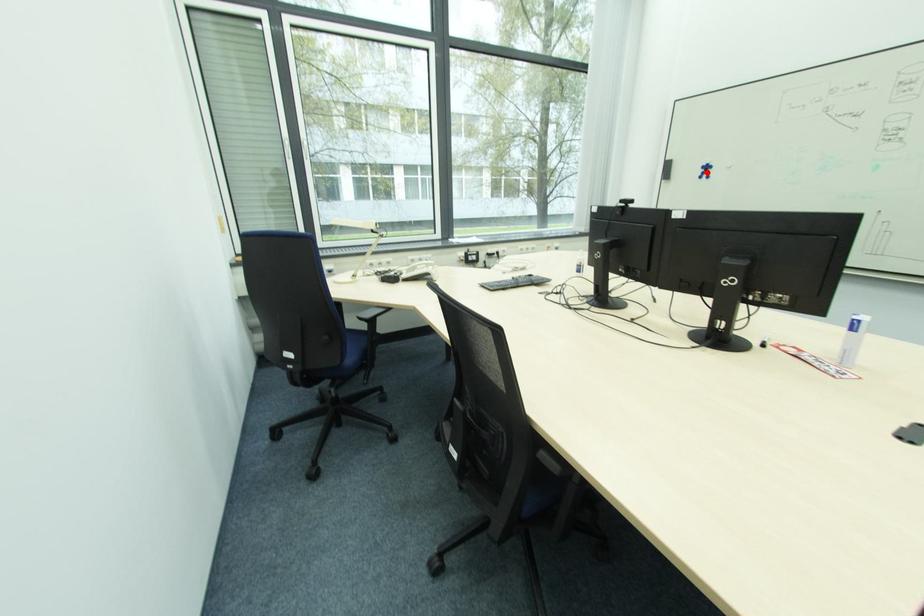
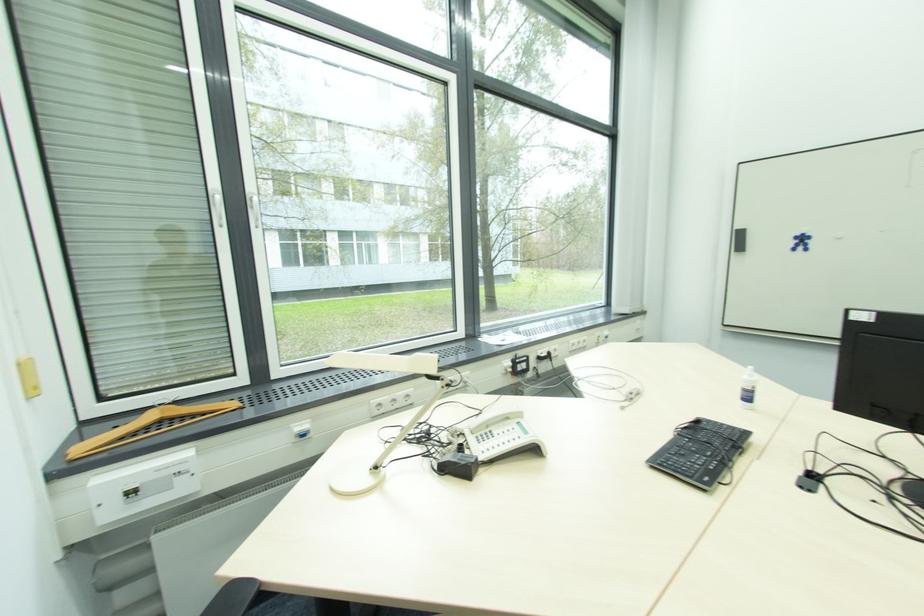
Where in the second image is the point corresponding to the highlighted location from the first image?

(801, 244)